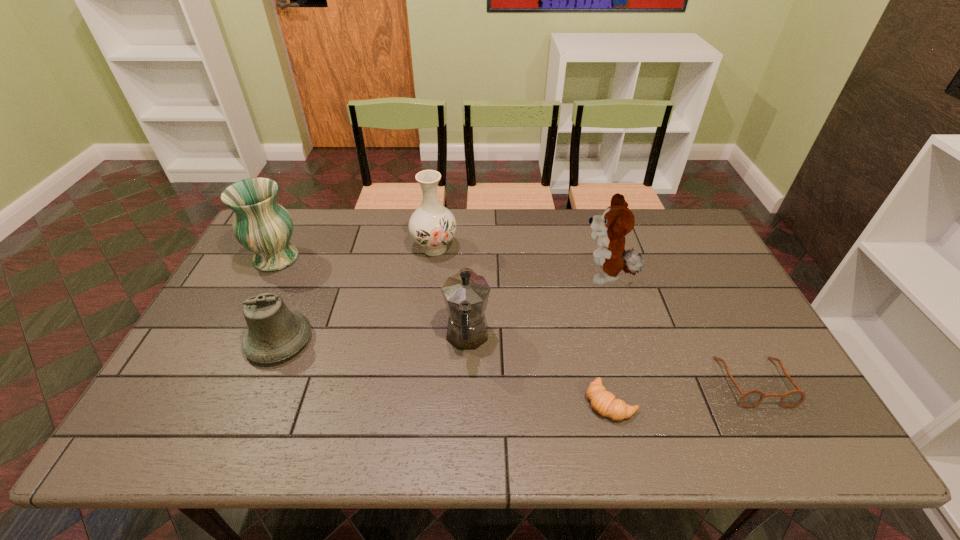
Find the location of a particular element. The image size is (960, 540). free region located 0.300m on the face of the puppy is located at coordinates (481, 276).

This screenshot has height=540, width=960. I want to click on free space located 0.050m on the front of the left vase, so click(261, 287).

Identify the location of vacant region located on the pouring side of the coffeepot. (468, 279).

You are a GUI agent. You are given a task and a screenshot of the screen. Output one action in this format:
    pyautogui.click(x=<x>, y=<y>)
    Task: Click on the free space located 0.180m on the pouring side of the coffeepot
    The height and width of the screenshot is (540, 960).
    Given the screenshot: What is the action you would take?
    pyautogui.click(x=468, y=268)

Identify the location of vacant space situated 0.130m on the pouring side of the coffeepot. Image resolution: width=960 pixels, height=540 pixels. (468, 279).

Locate an element on the screen. The height and width of the screenshot is (540, 960). free region located 0.130m on the right of the third shortest object is located at coordinates (361, 341).

Find the location of `free space located 0.050m on the front-facing side of the spectacles`. free space located 0.050m on the front-facing side of the spectacles is located at coordinates (779, 428).

The width and height of the screenshot is (960, 540). In order to click on vacant area situated 0.350m on the back of the crescent roll in this screenshot , I will do `click(582, 282)`.

Where is `object that is at the near edge`? This screenshot has height=540, width=960. object that is at the near edge is located at coordinates (604, 402).

Identify the location of vase at the left edge. (261, 225).